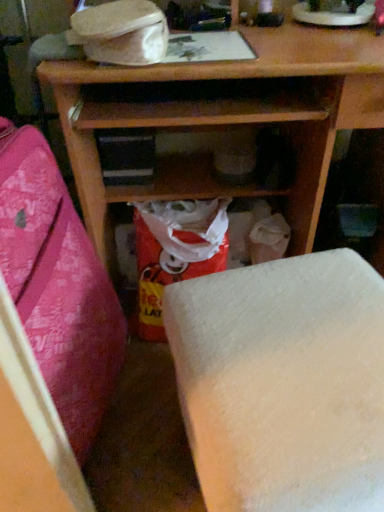
This screenshot has width=384, height=512. Find the location of `blank space situated above white matte foam at lower center, placed as the first furniture when sorted from right to left (from a real-world perspective)`. blank space situated above white matte foam at lower center, placed as the first furniture when sorted from right to left (from a real-world perspective) is located at coordinates (294, 332).